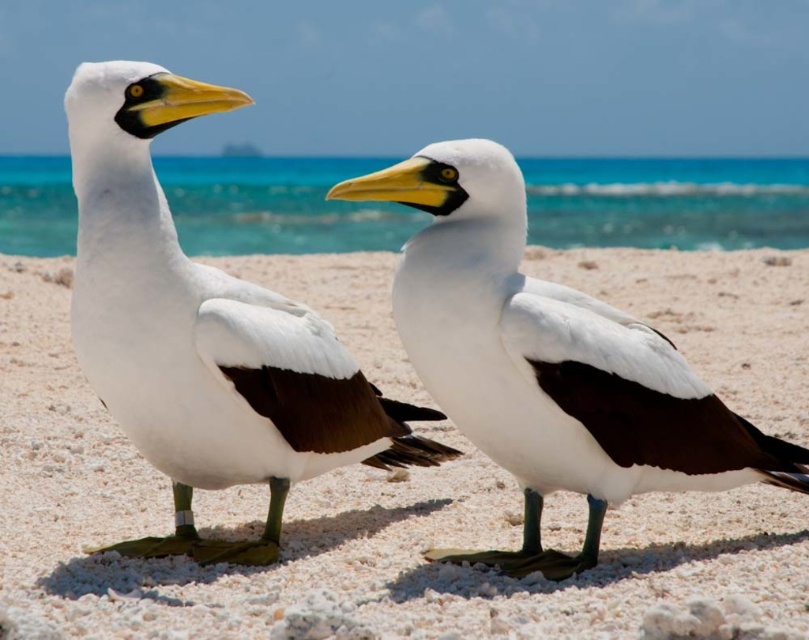
You are a wildlife photographer aiming to capture both the white matte mollymawk at left and the other bird in the image. Given their positions, which bird should you focus on first if you want to include both in your frame without moving the camera?

The white matte mollymawk at left is located at point (202, 332), so you should focus on the white matte mollymawk at left first to ensure both birds are in frame without moving the camera.

You are a photographer trying to capture both the white sandy beach at center and the white matte mollymawk at center in a single frame. Based on their positions, which object will appear closer to the camera in the photo?

The white sandy beach at center is positioned over the white matte mollymawk at center, so the white sandy beach at center will appear closer to the camera in the photo.